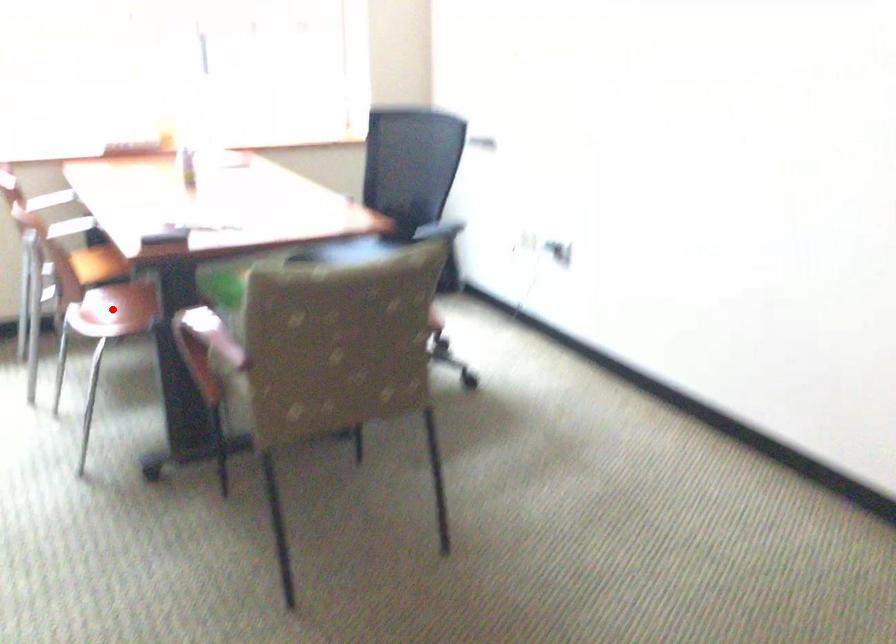
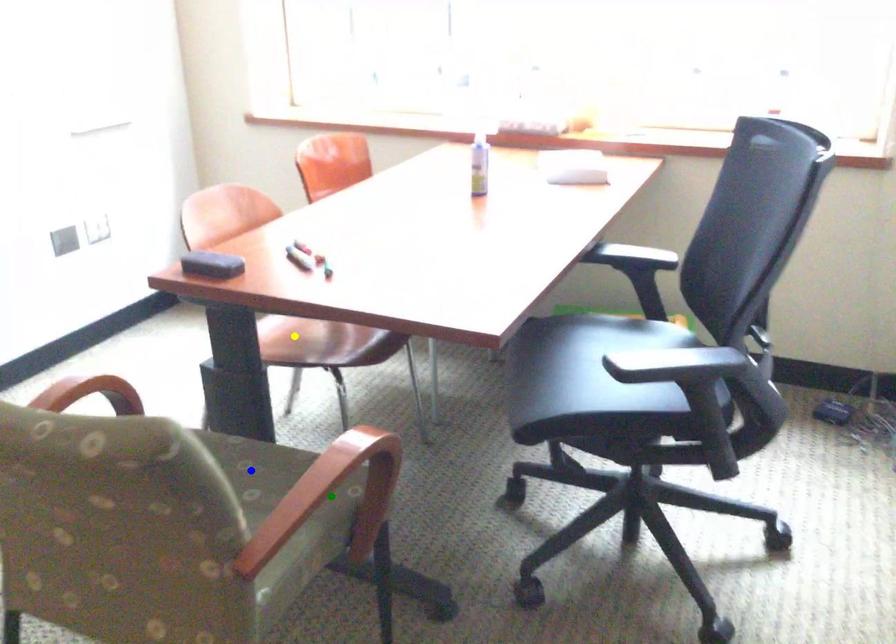
Question: I am providing you with two images of the same scene from different viewpoints. A red point is marked on the first image. You are given multiple points on the second image. Which mark in image 2 goes with the point in image 1?

Choices:
 (A) yellow point
 (B) blue point
 (C) green point

Answer: (A)